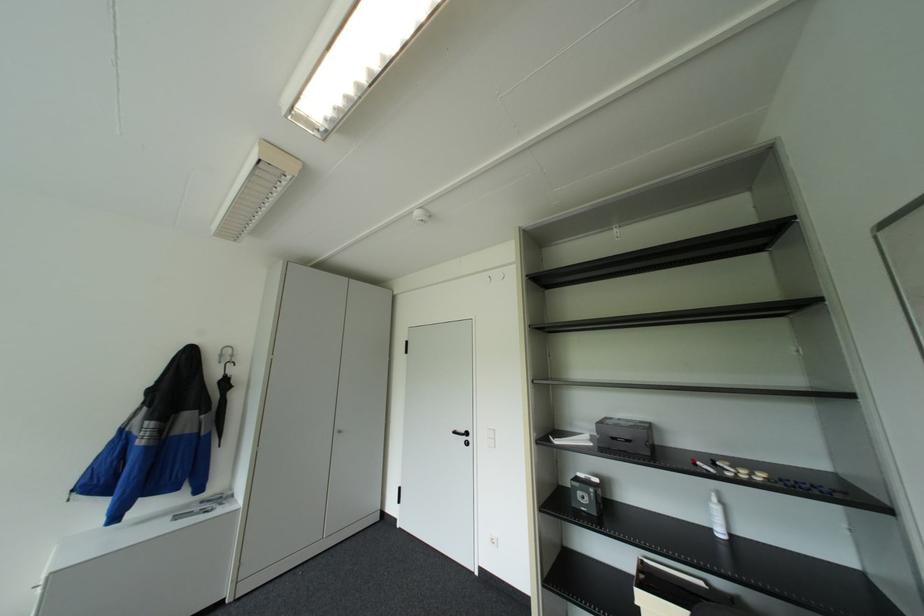
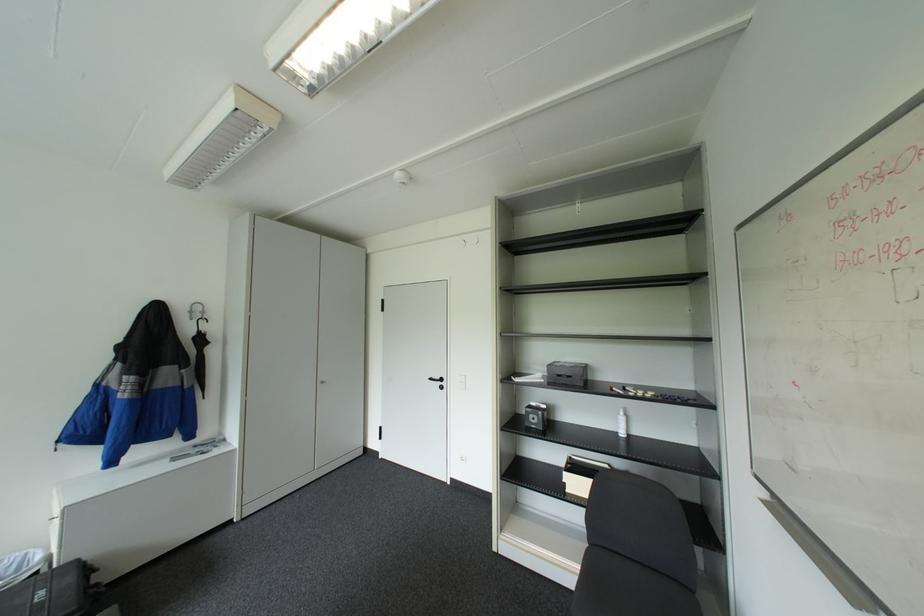
Find the pixel in the second image that matches (x=487, y=437) in the first image.

(459, 381)